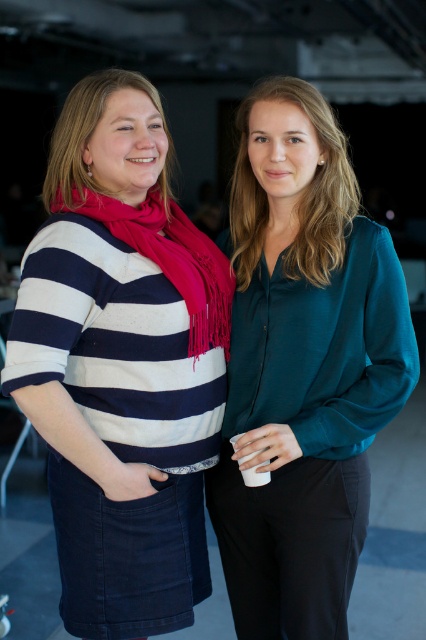
You are at a party and want to take a photo of the striped wool sweater at center without the matte red scarf at center appearing in the background. Is this possible given their positions?

The striped wool sweater at center is in front of the matte red scarf at center, so taking a photo directly from the front would include the scarf. To avoid it, move to a side angle where the sweater blocks the scarf from view.

You are standing in a room where two people are positioned closely. You have to decide which item is closer to you between the teal silk blouse at center and the matte red scarf at center. Which one is closer?

The teal silk blouse at center is closer to you because it is positioned further to the viewer than the matte red scarf at center.